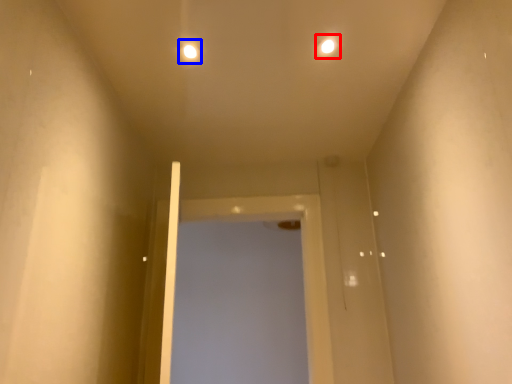
Question: Among these objects, which one is farthest to the camera, light (highlighted by a red box) or light (highlighted by a blue box)?

Choices:
 (A) light
 (B) light

Answer: (B)